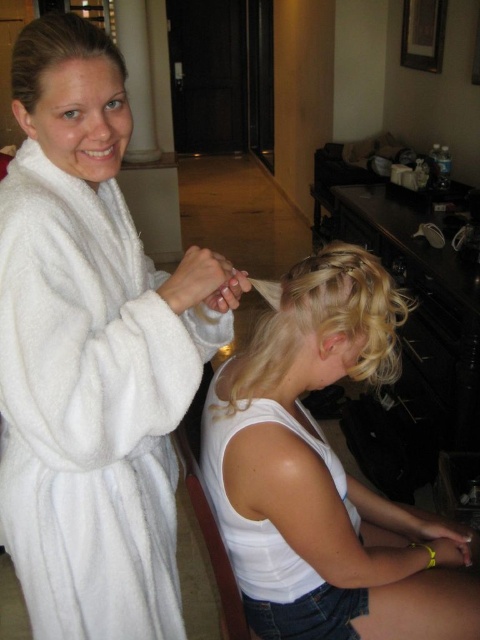
Question: Does white soft robe at upper left have a larger size compared to blonde silky hair at upper center?

Choices:
 (A) no
 (B) yes

Answer: (B)

Question: Can you confirm if white fluffy robe at left is positioned to the right of white soft robe at upper left?

Choices:
 (A) yes
 (B) no

Answer: (B)

Question: Which point is farther to the camera?

Choices:
 (A) (285, 577)
 (B) (358, 529)
 (C) (304, 323)
 (D) (12, 77)

Answer: (B)

Question: Can you confirm if white fluffy robe at left is positioned to the left of blonde hair at center?

Choices:
 (A) no
 (B) yes

Answer: (B)

Question: Considering the real-world distances, which object is closest to the blonde hair at center?

Choices:
 (A) white soft robe at upper left
 (B) blonde curly hair at center

Answer: (A)

Question: Which point is closer to the camera?

Choices:
 (A) (25, 451)
 (B) (332, 636)
 (C) (239, 572)
 (D) (388, 337)

Answer: (A)